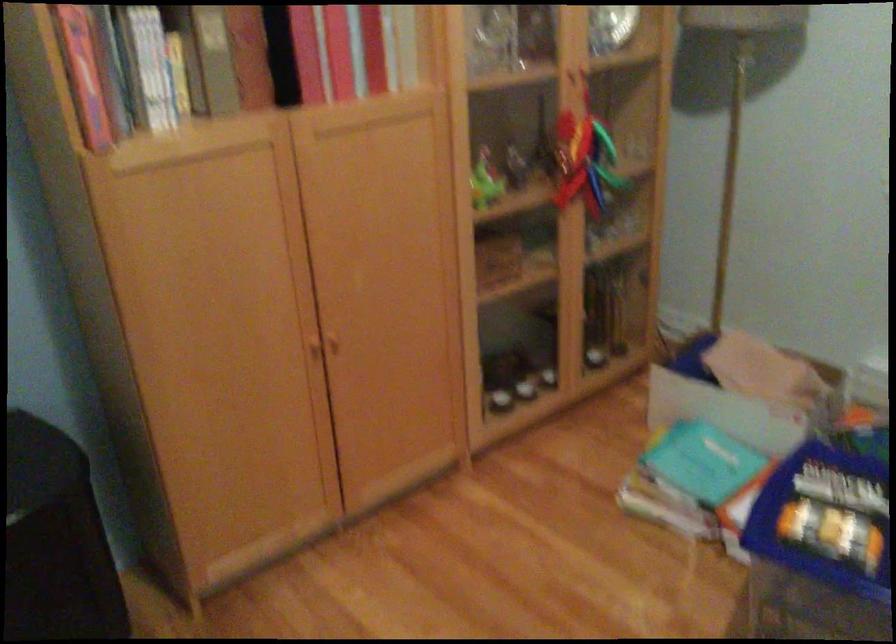
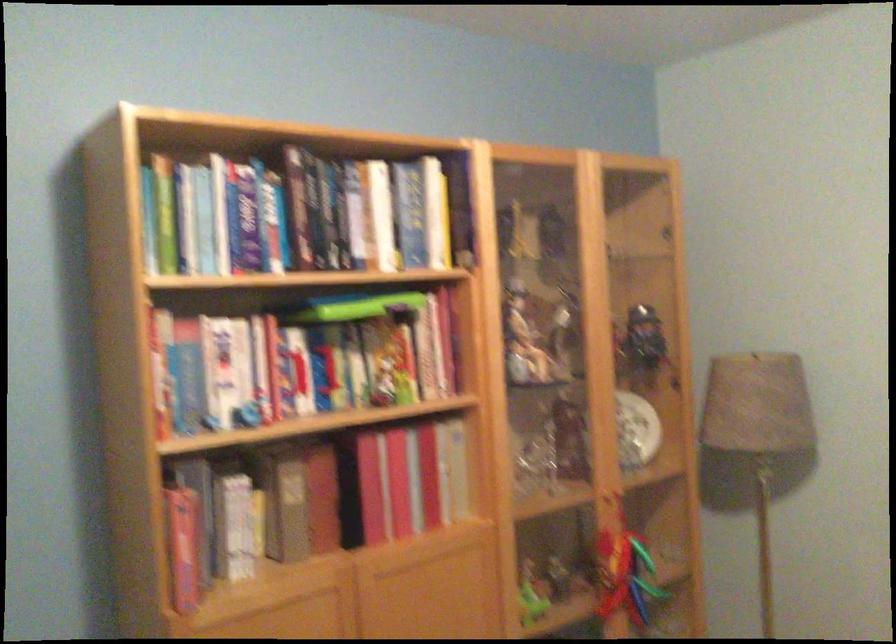
In the second image, find the point that corresponds to point (564, 82) in the first image.

(605, 500)